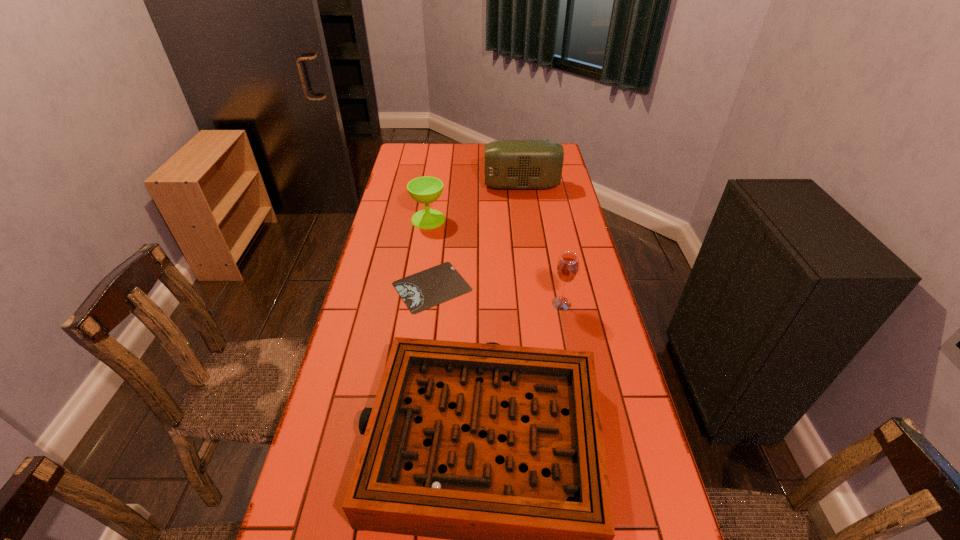
Identify the location of empty space between the taller wineglass and the mousepad. The width and height of the screenshot is (960, 540). (496, 295).

Locate an element on the screen. vacant area that lies between the nearer wineglass and the shortest object is located at coordinates (x=496, y=295).

You are a GUI agent. You are given a task and a screenshot of the screen. Output one action in this format:
    pyautogui.click(x=<x>, y=<y>)
    Task: Click on the vacant region between the nearer wineglass and the mousepad
    
    Given the screenshot: What is the action you would take?
    pyautogui.click(x=496, y=295)

The height and width of the screenshot is (540, 960). Find the location of `vacant region between the third shortest object and the mousepad`. vacant region between the third shortest object and the mousepad is located at coordinates (430, 253).

Identify the location of empty location between the left wineglass and the farthest object. The image size is (960, 540). (475, 202).

Point out which object is positioned as the fourth nearest to the fourth tallest object. Please provide its 2D coordinates. Your answer should be formatted as a tuple, i.e. [(x, y)], where the tuple contains the x and y coordinates of a point satisfying the conditions above.

[(509, 164)]

Identify the location of object that ranks as the third closest to the shortest object. click(x=567, y=268).

This screenshot has height=540, width=960. Find the location of `vacant point that satisfies the following two spatial constraints: 1. on the front-facing side of the radio_receiver; 2. on the left side of the right wineglass`. vacant point that satisfies the following two spatial constraints: 1. on the front-facing side of the radio_receiver; 2. on the left side of the right wineglass is located at coordinates (538, 303).